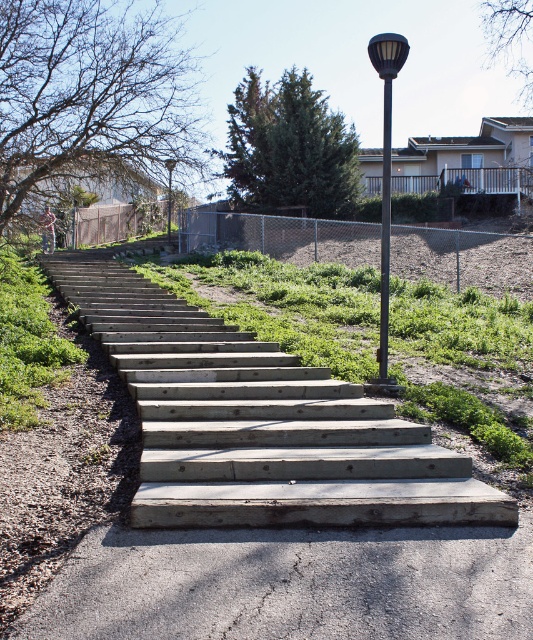
Who is more forward, (353,576) or (17,385)?

Positioned in front is point (353,576).

Can you confirm if gray concrete pavement at lower center is positioned below green leafy grass at left?

Yes.

Where is `gray concrete pavement at lower center`? gray concrete pavement at lower center is located at coordinates (290, 584).

At what (x,y) coordinates should I click in order to perform the action: click on gray concrete pavement at lower center. Please return your answer as a coordinate pair (x, y). The image size is (533, 640). Looking at the image, I should click on (290, 584).

This screenshot has height=640, width=533. Describe the element at coordinates (27, 340) in the screenshot. I see `green leafy grass at left` at that location.

Between point (6, 330) and point (384, 35), which one is positioned behind?

Point (6, 330)

Locate an element on the screen. This screenshot has width=533, height=640. green leafy grass at left is located at coordinates (27, 340).

Who is shorter, wooden stairs at center or black metal pole at upper center?

wooden stairs at center is shorter.

Is point (185, 502) positioned behind point (385, 300)?

No, it is in front of (385, 300).

Does point (409, 456) come behind point (393, 77)?

That is False.

Where is `wooden stairs at center`? The image size is (533, 640). wooden stairs at center is located at coordinates (259, 422).